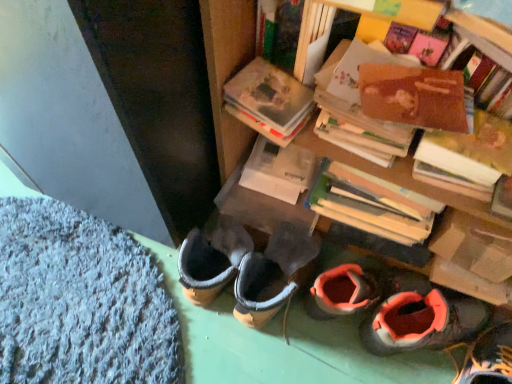
Locate an element on the screen. Image resolution: width=512 pixels, height=384 pixels. free spot above white matte book at center (from a real-world perspective) is located at coordinates (279, 165).